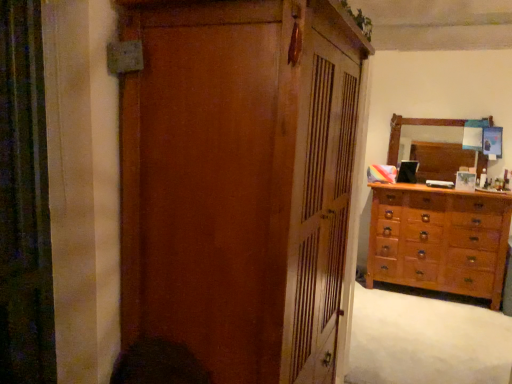
Question: Is light brown wooden dresser at right to the right of wooden mirror at upper right from the viewer's perspective?

Choices:
 (A) no
 (B) yes

Answer: (A)

Question: From a real-world perspective, is light brown wooden dresser at right below wooden mirror at upper right?

Choices:
 (A) yes
 (B) no

Answer: (A)

Question: Is light brown wooden dresser at right smaller than wooden mirror at upper right?

Choices:
 (A) yes
 (B) no

Answer: (B)

Question: Is the depth of light brown wooden dresser at right greater than that of wooden mirror at upper right?

Choices:
 (A) yes
 (B) no

Answer: (B)

Question: Is light brown wooden dresser at right oriented towards wooden mirror at upper right?

Choices:
 (A) yes
 (B) no

Answer: (B)

Question: Is light brown wooden dresser at right inside the boundaries of matte wood cupboard at center, or outside?

Choices:
 (A) outside
 (B) inside

Answer: (A)

Question: In terms of height, does light brown wooden dresser at right look taller or shorter compared to matte wood cupboard at center?

Choices:
 (A) short
 (B) tall

Answer: (A)

Question: Is light brown wooden dresser at right bigger or smaller than matte wood cupboard at center?

Choices:
 (A) big
 (B) small

Answer: (B)

Question: Would you say light brown wooden dresser at right is to the left or to the right of matte wood cupboard at center in the picture?

Choices:
 (A) left
 (B) right

Answer: (B)

Question: Considering their positions, is matte wood cupboard at center located in front of or behind wooden mirror at upper right?

Choices:
 (A) front
 (B) behind

Answer: (A)

Question: In the image, is matte wood cupboard at center on the left side or the right side of wooden mirror at upper right?

Choices:
 (A) left
 (B) right

Answer: (A)

Question: Is matte wood cupboard at center wider or thinner than wooden mirror at upper right?

Choices:
 (A) wide
 (B) thin

Answer: (A)

Question: Considering the positions of matte wood cupboard at center and wooden mirror at upper right in the image, is matte wood cupboard at center taller or shorter than wooden mirror at upper right?

Choices:
 (A) tall
 (B) short

Answer: (A)

Question: Based on their positions, is matte wood cupboard at center located to the left or right of light brown wooden dresser at right?

Choices:
 (A) left
 (B) right

Answer: (A)

Question: Is matte wood cupboard at center inside or outside of light brown wooden dresser at right?

Choices:
 (A) outside
 (B) inside

Answer: (A)